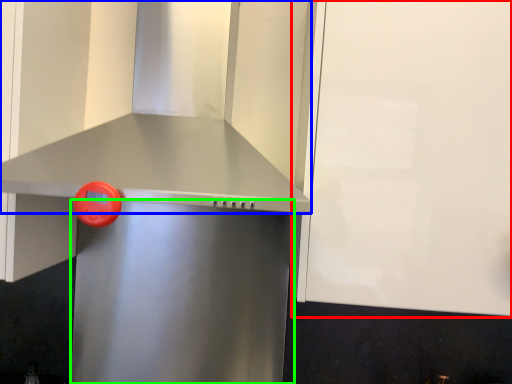
Question: Based on their relative distances, which object is nearer to cabinetry (highlighted by a red box)? Choose from vent (highlighted by a blue box) and appliance (highlighted by a green box).

Choices:
 (A) vent
 (B) appliance

Answer: (A)